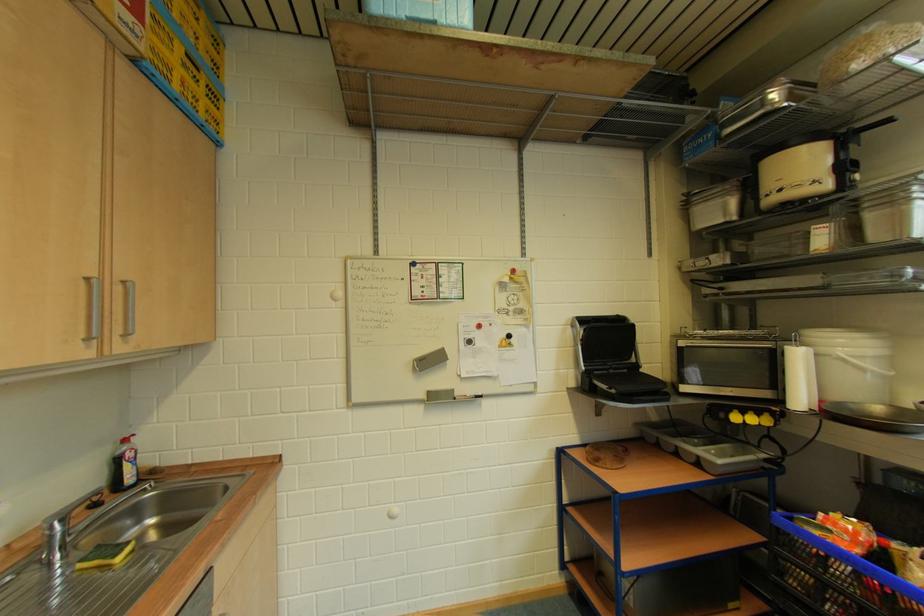
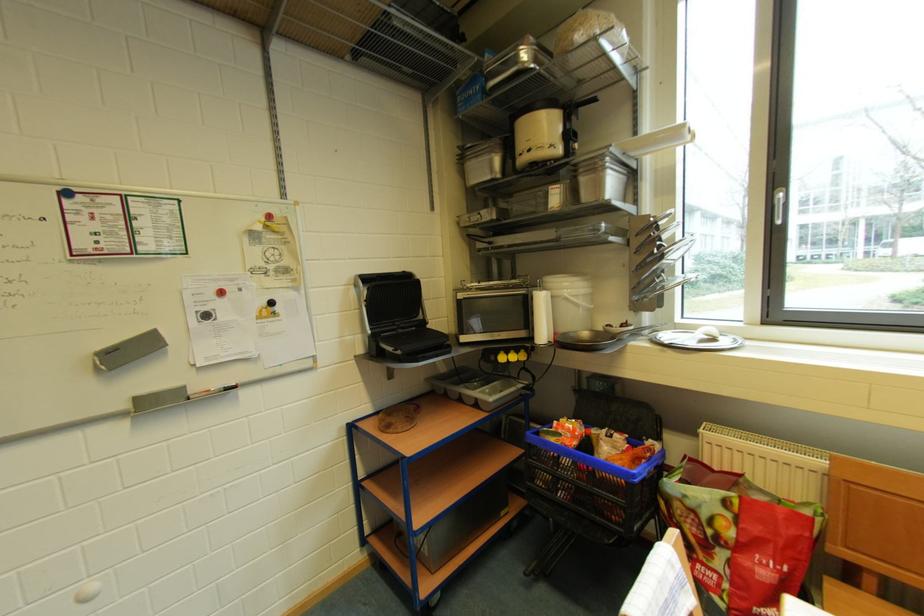
In the second image, find the point that corresponds to point 858,360 in the first image.

(578, 299)